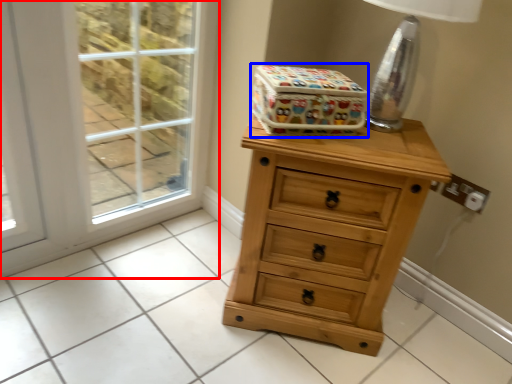
Question: Which object appears farthest to the camera in this image, screen door (highlighted by a red box) or storage box (highlighted by a blue box)?

Choices:
 (A) screen door
 (B) storage box

Answer: (A)